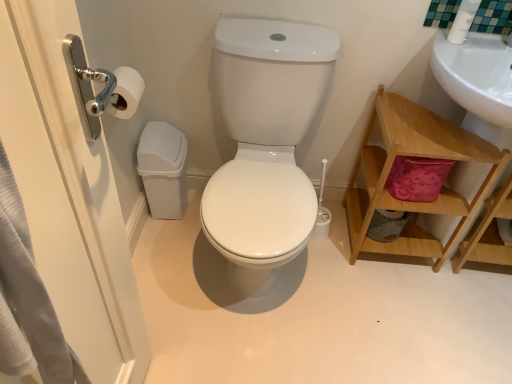
Question: Is white glossy toilet at center positioned before wooden shelf at right?

Choices:
 (A) yes
 (B) no

Answer: (A)

Question: Does white glossy toilet at center lie behind wooden shelf at right?

Choices:
 (A) no
 (B) yes

Answer: (A)

Question: Is white glossy toilet at center shorter than wooden shelf at right?

Choices:
 (A) no
 (B) yes

Answer: (A)

Question: Is white glossy toilet at center positioned far away from wooden shelf at right?

Choices:
 (A) yes
 (B) no

Answer: (B)

Question: Can you confirm if white glossy toilet at center is wider than wooden shelf at right?

Choices:
 (A) yes
 (B) no

Answer: (A)

Question: Is point (29, 142) closer or farther from the camera than point (409, 253)?

Choices:
 (A) farther
 (B) closer

Answer: (B)

Question: From a real-world perspective, relative to wooden shelf at right, is brushed metal door handle at left vertically above or below?

Choices:
 (A) below
 (B) above

Answer: (B)

Question: Would you say brushed metal door handle at left is inside or outside wooden shelf at right?

Choices:
 (A) outside
 (B) inside

Answer: (A)

Question: Considering the positions of brushed metal door handle at left and wooden shelf at right in the image, is brushed metal door handle at left bigger or smaller than wooden shelf at right?

Choices:
 (A) big
 (B) small

Answer: (B)

Question: Based on their positions, is white plastic toilet brush at upper right located to the left or right of white glossy toilet at center?

Choices:
 (A) right
 (B) left

Answer: (A)

Question: Would you say white plastic toilet brush at upper right is inside or outside white glossy toilet at center?

Choices:
 (A) inside
 (B) outside

Answer: (B)

Question: Is white plastic toilet brush at upper right in front of or behind white glossy toilet at center in the image?

Choices:
 (A) front
 (B) behind

Answer: (B)

Question: Is white plastic toilet brush at upper right taller or shorter than white glossy toilet at center?

Choices:
 (A) tall
 (B) short

Answer: (B)

Question: In terms of height, does brushed metal door handle at left look taller or shorter compared to white plastic toilet brush at upper right?

Choices:
 (A) short
 (B) tall

Answer: (B)

Question: Considering the positions of point (79, 258) and point (478, 1), is point (79, 258) closer or farther from the camera than point (478, 1)?

Choices:
 (A) farther
 (B) closer

Answer: (B)